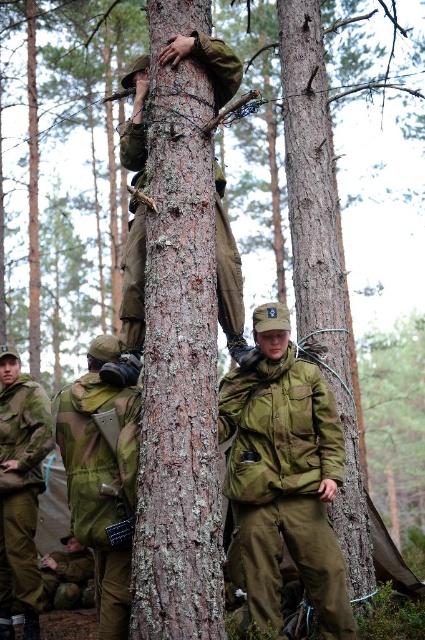
Question: Is brown rough bark at center positioned at the back of camouflage fabric backpack at center?

Choices:
 (A) no
 (B) yes

Answer: (B)

Question: Can you confirm if smooth bark tree trunk at center is positioned below brown rough bark at center?

Choices:
 (A) no
 (B) yes

Answer: (B)

Question: Which point is farther to the camera?

Choices:
 (A) (0, 406)
 (B) (246, 524)
 (C) (337, 250)

Answer: (A)

Question: Among these points, which one is farthest from the camera?

Choices:
 (A) (53, 557)
 (B) (0, 464)
 (C) (79, 394)

Answer: (A)

Question: Is camouflage fabric backpack at center positioned before camouflage fabric uniform at center?

Choices:
 (A) no
 (B) yes

Answer: (B)

Question: Which of the following is the farthest from the observer?

Choices:
 (A) matte green uniform at center
 (B) brown rough bark at center

Answer: (B)